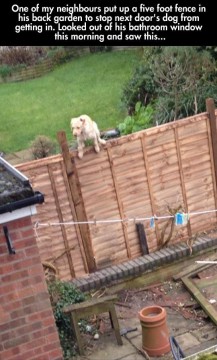
Find the location of a particular element. This screenshot has height=360, width=217. brick wall is located at coordinates pyautogui.click(x=39, y=322).